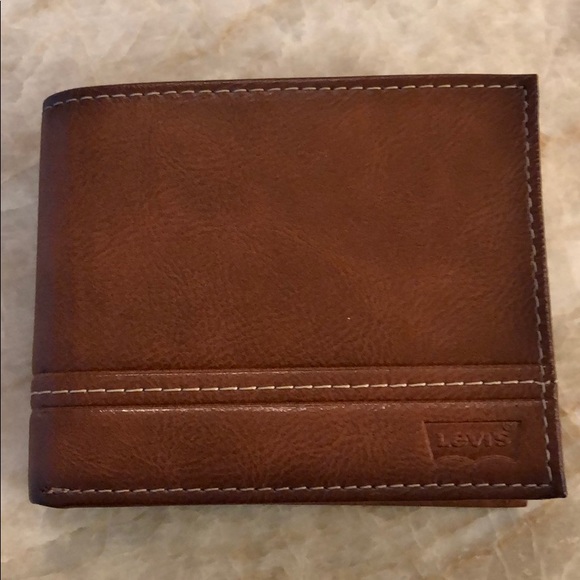
The image size is (580, 580). Find the location of `floor`. floor is located at coordinates (300, 548).